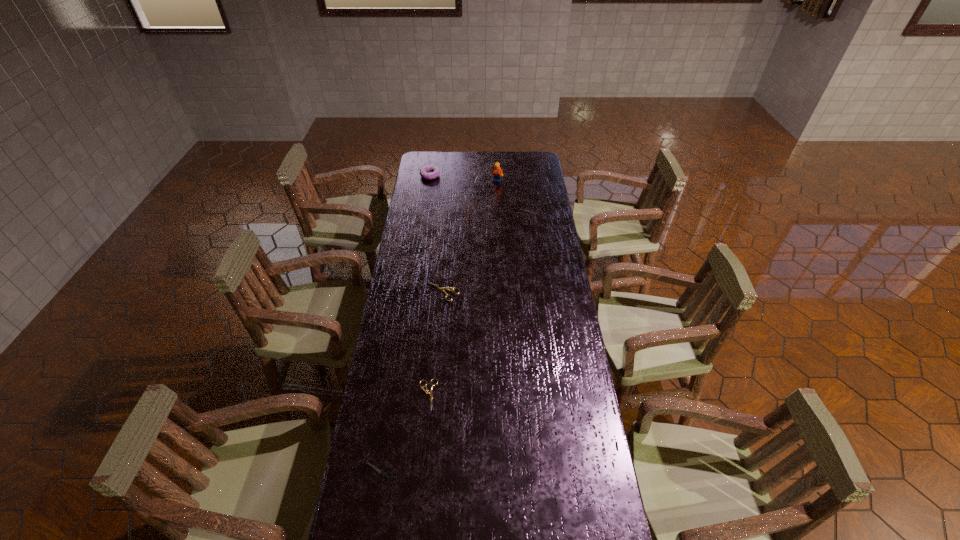
The height and width of the screenshot is (540, 960). I want to click on the nearest object, so click(x=384, y=475).

Identify the location of the left black shears. The width and height of the screenshot is (960, 540). (384, 475).

Find the location of a particular element. Image resolution: width=960 pixels, height=540 pixels. free space located on the front-facing side of the Lego is located at coordinates (497, 194).

The height and width of the screenshot is (540, 960). What are the coordinates of `free spot located 0.050m on the face of the sunglasses` in the screenshot? It's located at (479, 214).

At what (x,y) coordinates should I click in order to perform the action: click on blank space located on the back of the doughnut. Please return your answer as a coordinate pair (x, y). This screenshot has width=960, height=540. Looking at the image, I should click on (433, 154).

Where is `free space located 0.300m on the back of the farther black shears`? The image size is (960, 540). free space located 0.300m on the back of the farther black shears is located at coordinates 522,174.

I want to click on vacant space located on the front of the farther beige shears, so click(x=441, y=319).

The width and height of the screenshot is (960, 540). I want to click on free spot located on the back of the smaller beige shears, so click(434, 323).

Where is `blank area located 0.350m on the back of the smaller black shears`? The width and height of the screenshot is (960, 540). blank area located 0.350m on the back of the smaller black shears is located at coordinates (396, 364).

Where is `object that is at the far edge`? The width and height of the screenshot is (960, 540). object that is at the far edge is located at coordinates (424, 171).